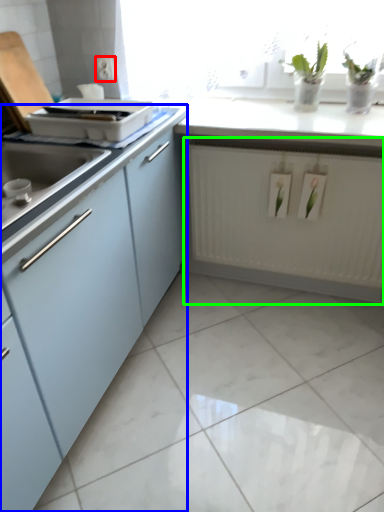
Question: Which is nearer to the electric outlet (highlighted by a red box)? cabinetry (highlighted by a blue box) or radiator (highlighted by a green box).

Choices:
 (A) cabinetry
 (B) radiator

Answer: (A)